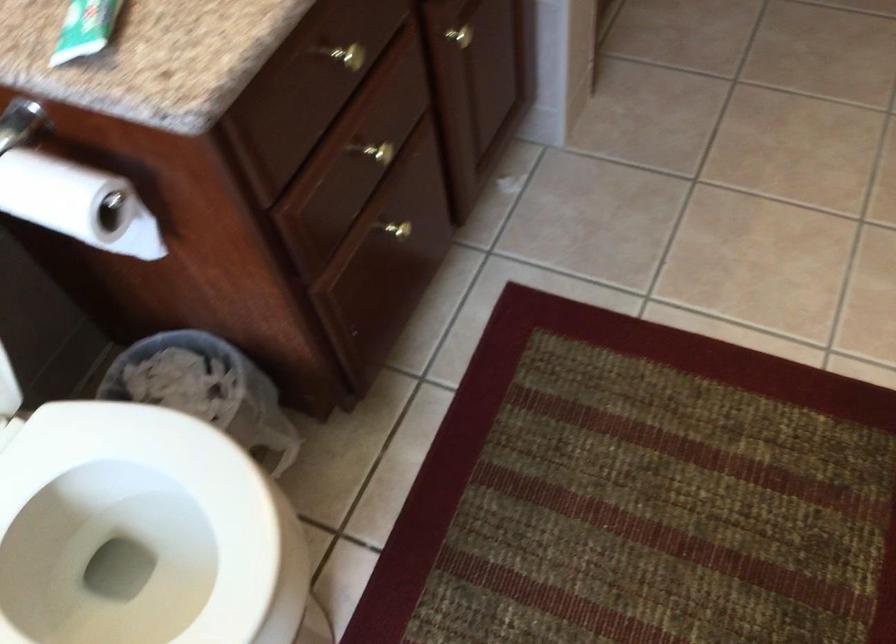
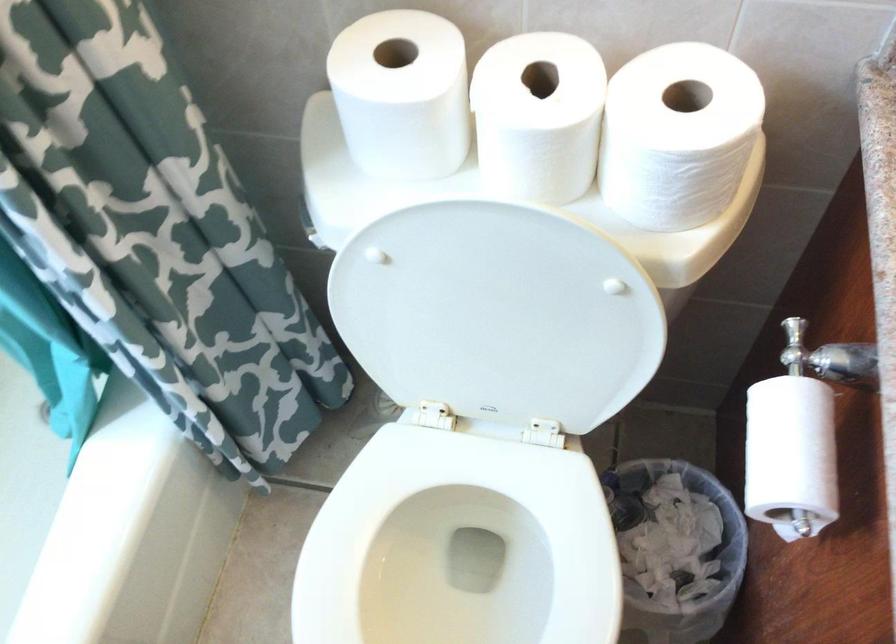
First-person continuous shooting, in which direction is the camera rotating?

The camera rotated toward left-down.